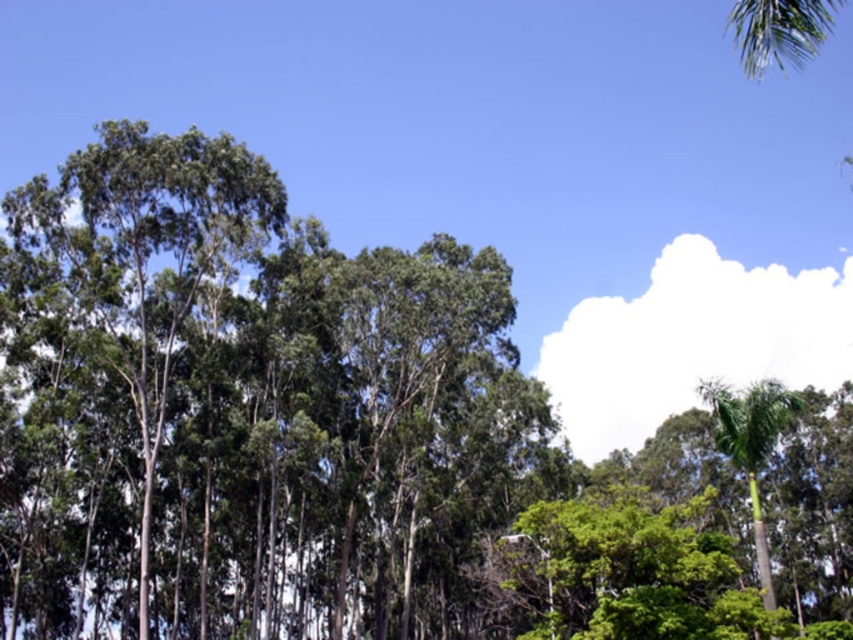
Question: Which point is farther to the camera?

Choices:
 (A) [x=758, y=548]
 (B) [x=192, y=612]

Answer: (B)

Question: Does green leafy trees at center lie behind green leafy palm at right?

Choices:
 (A) yes
 (B) no

Answer: (A)

Question: Can you confirm if green leafy trees at center is positioned above green leafy palm at right?

Choices:
 (A) no
 (B) yes

Answer: (A)

Question: Is green leafy trees at center to the left of green leafy palm at right from the viewer's perspective?

Choices:
 (A) no
 (B) yes

Answer: (B)

Question: Which point is closer to the camera?

Choices:
 (A) green leafy palm at right
 (B) green leafy trees at center

Answer: (A)